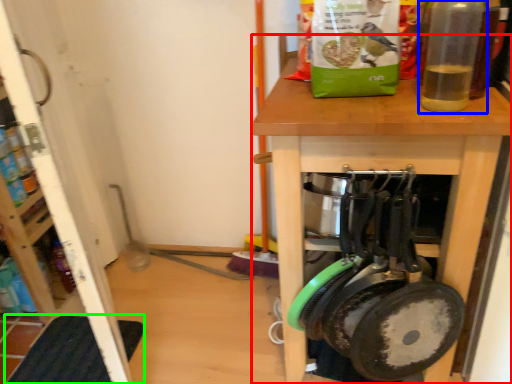
Question: Considering the real-world distances, which object is closest to desk (highlighted by a red box)? bottle (highlighted by a blue box) or mat (highlighted by a green box).

Choices:
 (A) bottle
 (B) mat

Answer: (A)